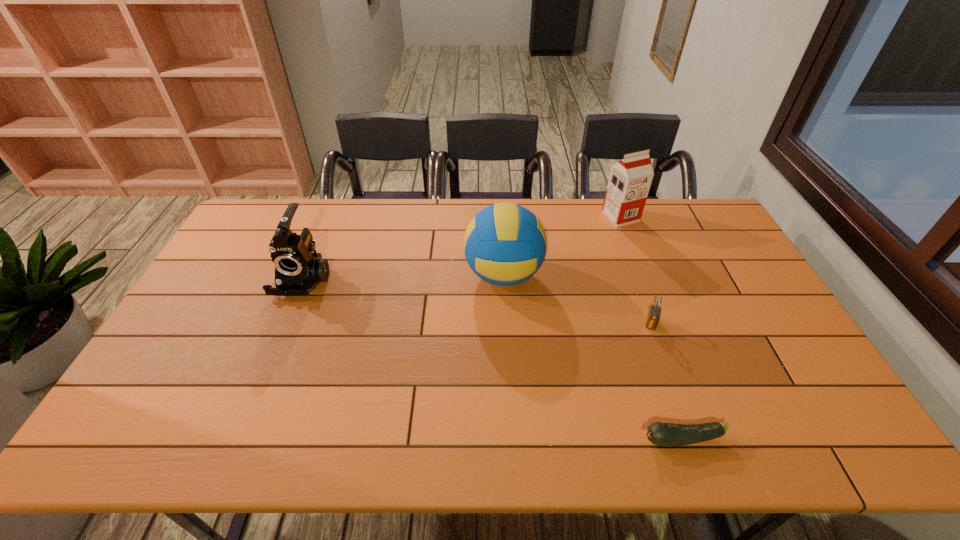
The height and width of the screenshot is (540, 960). In order to click on vacant space located on the right of the second shortest object in this screenshot , I will do `click(728, 323)`.

Locate an element on the screen. The width and height of the screenshot is (960, 540). blank space located at the blossom end of the shortest object is located at coordinates pos(567,440).

Locate an element on the screen. The height and width of the screenshot is (540, 960). blank space located 0.380m at the blossom end of the shortest object is located at coordinates (472, 440).

This screenshot has height=540, width=960. In order to click on free space located 0.240m at the blossom end of the shortest object in this screenshot , I will do `click(533, 440)`.

Locate an element on the screen. Image resolution: width=960 pixels, height=540 pixels. object that is at the far edge is located at coordinates (630, 179).

The height and width of the screenshot is (540, 960). Identify the location of object present at the near edge. tap(665, 434).

The width and height of the screenshot is (960, 540). In the image, there is a desktop. In order to click on vacant area at the far edge in this screenshot , I will do `click(358, 224)`.

This screenshot has height=540, width=960. I want to click on vacant area at the near edge of the desktop, so click(x=597, y=451).

Locate an element on the screen. This screenshot has height=540, width=960. free location at the left edge is located at coordinates (219, 301).

Where is `vacant space at the right edge of the desktop`? Image resolution: width=960 pixels, height=540 pixels. vacant space at the right edge of the desktop is located at coordinates pos(760,370).